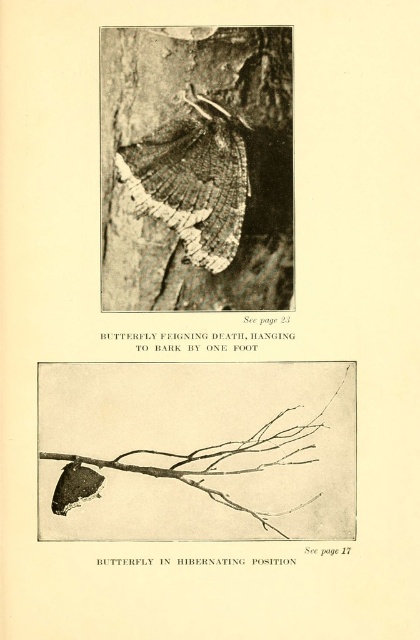
Question: Does brown textured branch at lower left have a larger size compared to smooth bark tree trunk at center?

Choices:
 (A) yes
 (B) no

Answer: (B)

Question: Which point is closer to the camera?

Choices:
 (A) (212, 444)
 (B) (152, 269)

Answer: (A)

Question: Which point is farther to the camera?

Choices:
 (A) (191, 385)
 (B) (209, 38)

Answer: (A)

Question: Is brown textured branch at lower left further to the viewer compared to smooth bark tree trunk at center?

Choices:
 (A) no
 (B) yes

Answer: (B)

Question: Where is brown textured branch at lower left located in relation to smooth bark tree trunk at center in the image?

Choices:
 (A) right
 (B) left

Answer: (A)